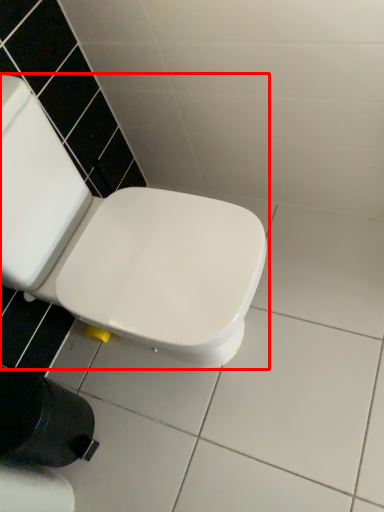
Question: From the image's perspective, what is the correct spatial relationship of toilet (annotated by the red box) in relation to toilet paper?

Choices:
 (A) below
 (B) above

Answer: (B)